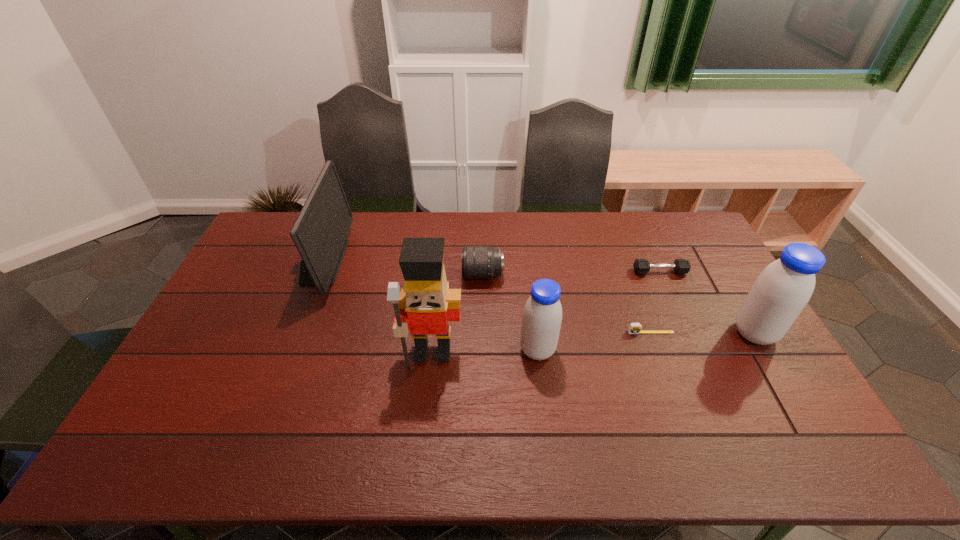
Image resolution: width=960 pixels, height=540 pixels. I want to click on free location located on the left of the taller soya milk, so click(709, 333).

You are a GUI agent. You are given a task and a screenshot of the screen. Output one action in this format:
    pyautogui.click(x=<x>, y=<y>)
    Task: Click on the vacant space located on the surface of the fifth tallest object
    This screenshot has height=540, width=960.
    Given the screenshot: What is the action you would take?
    pyautogui.click(x=433, y=275)

The width and height of the screenshot is (960, 540). Find the location of `free space located on the surface of the fifth tallest object`. free space located on the surface of the fifth tallest object is located at coordinates (427, 275).

Identify the location of free region located on the surface of the fifth tallest object. (419, 275).

In order to click on vacant space located 0.050m on the screen side of the computer monitor in this screenshot , I will do `click(358, 262)`.

Find the location of a particular element. The image size is (960, 540). vacant space located on the right of the second shortest object is located at coordinates (707, 272).

At what (x,y) coordinates should I click in order to perform the action: click on vacant space located in front of the nutcracker holding the staff. Please return your answer as a coordinate pair (x, y). Looking at the image, I should click on (427, 410).

This screenshot has width=960, height=540. I want to click on vacant space located at the front of the shortest object with the tape extended, so click(x=663, y=368).

Where is `object present at the far edge`? Image resolution: width=960 pixels, height=540 pixels. object present at the far edge is located at coordinates (319, 233).

Find the location of a particular element. soya milk that is at the right edge is located at coordinates (781, 291).